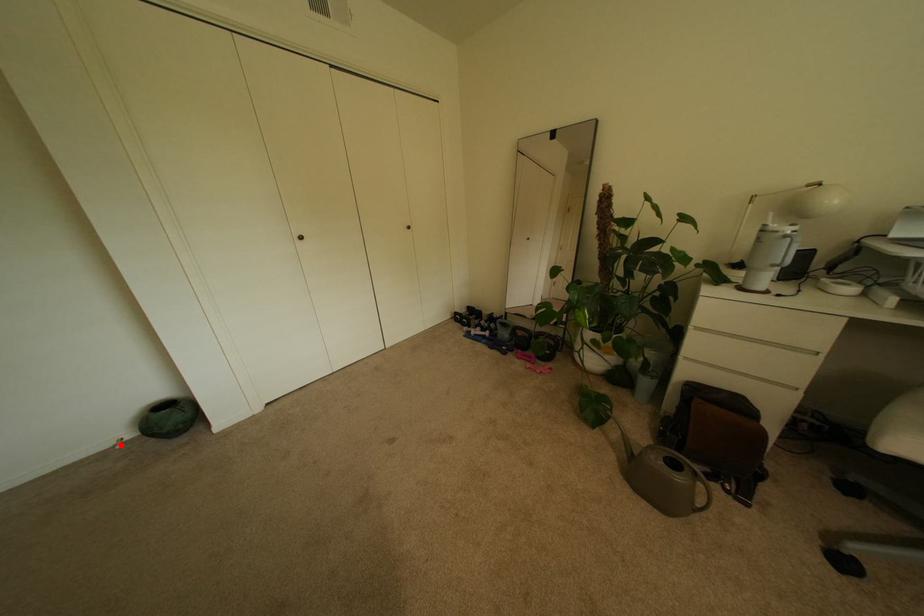
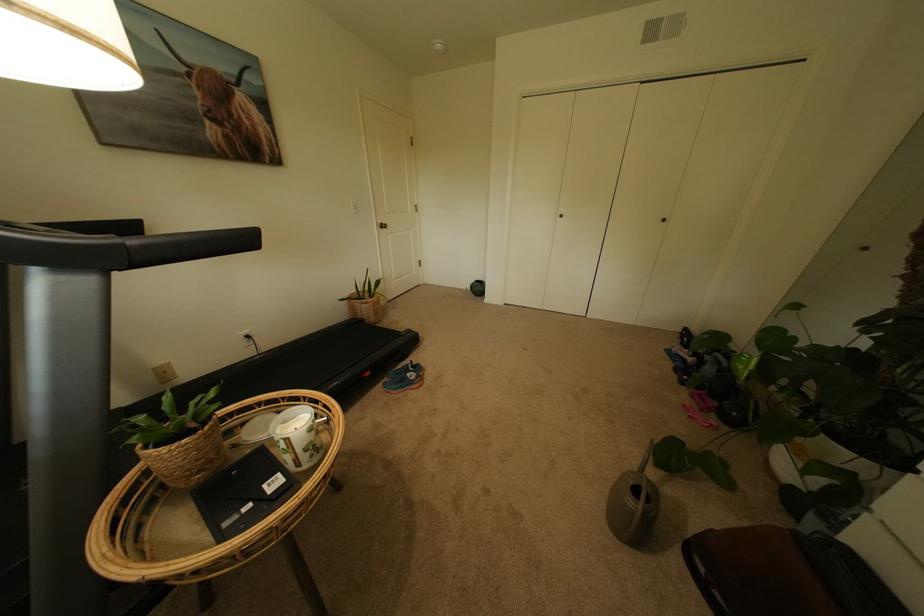
Locate, in the second image, the point that corresponds to the highlighted location in the first image.

(473, 289)